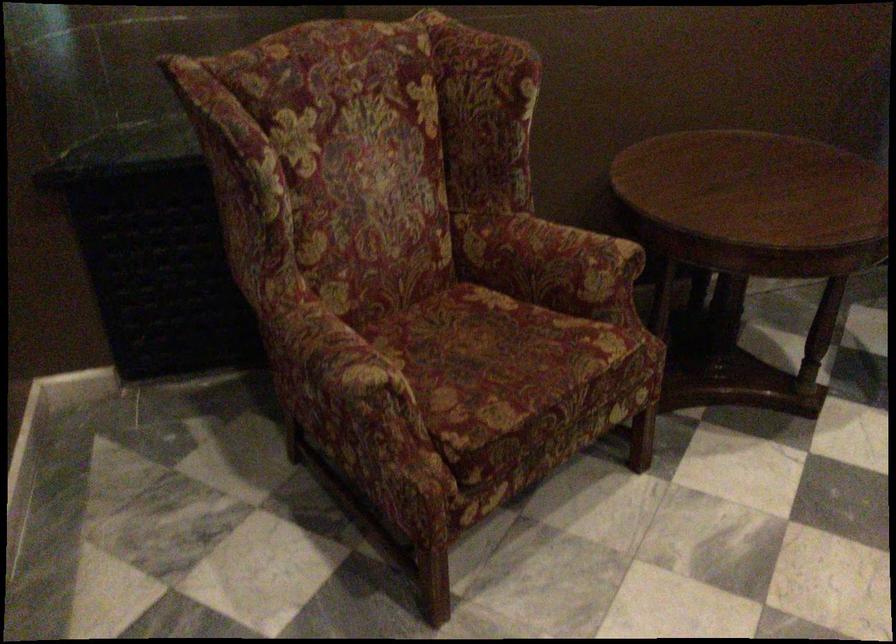
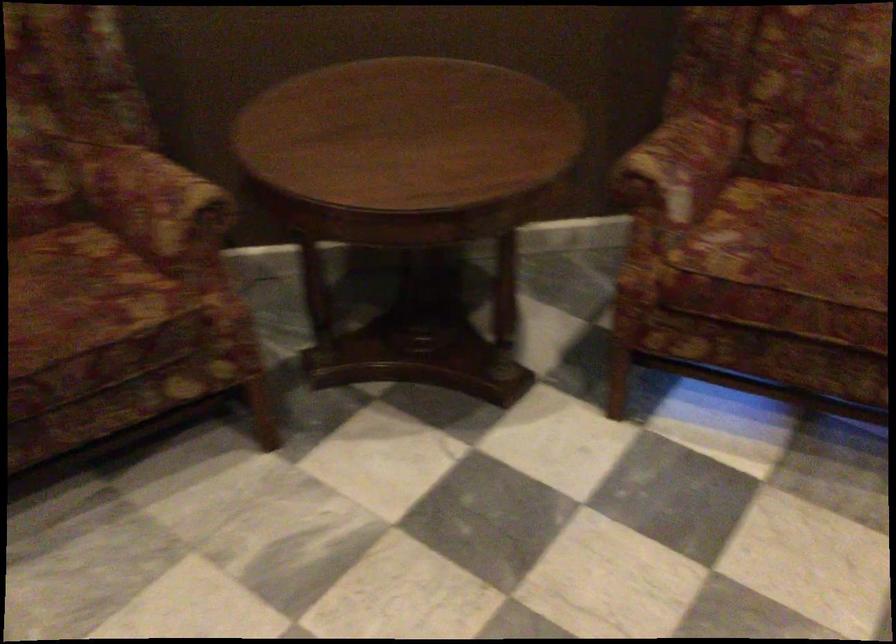
Locate, in the second image, the point that corresponds to the point at 533,337 in the first image.

(80, 292)